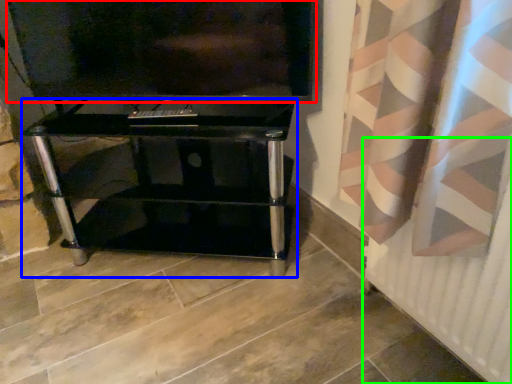
Question: Estimate the real-world distances between objects in this image. Which object is closer to television (highlighted by a red box), furniture (highlighted by a blue box) or radiator (highlighted by a green box)?

Choices:
 (A) furniture
 (B) radiator

Answer: (A)